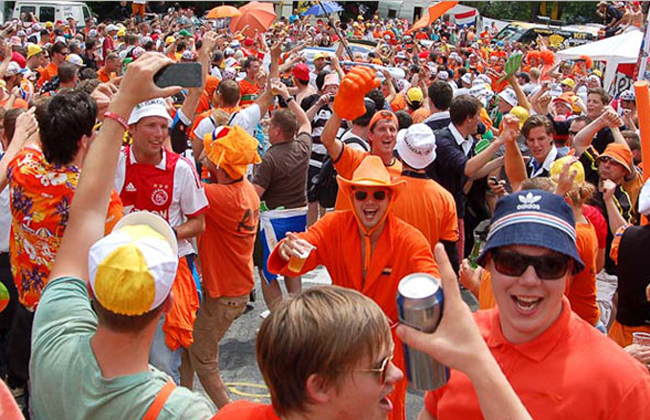
Locate an element on the screen. This screenshot has width=650, height=420. cup of beer is located at coordinates pos(299,263).